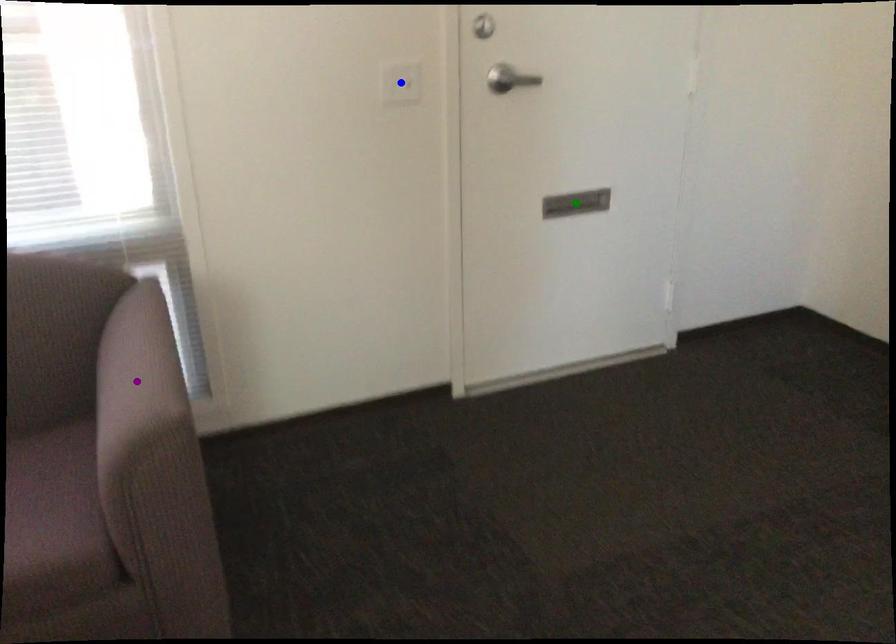
Order these from farthest to nearest:
1. blue point
2. green point
3. purple point

1. green point
2. blue point
3. purple point